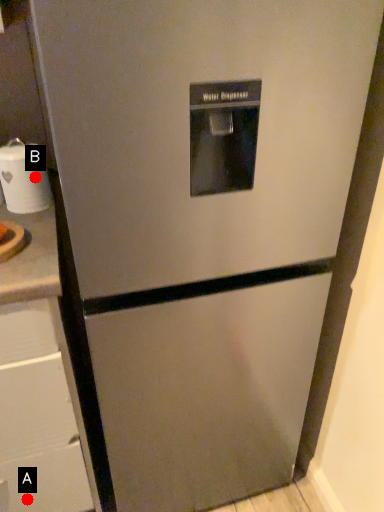
Question: Two points are circled on the image, labeled by A and B beside each circle. Which point appears closest to the camera in this image?

Choices:
 (A) A is closer
 (B) B is closer

Answer: (B)